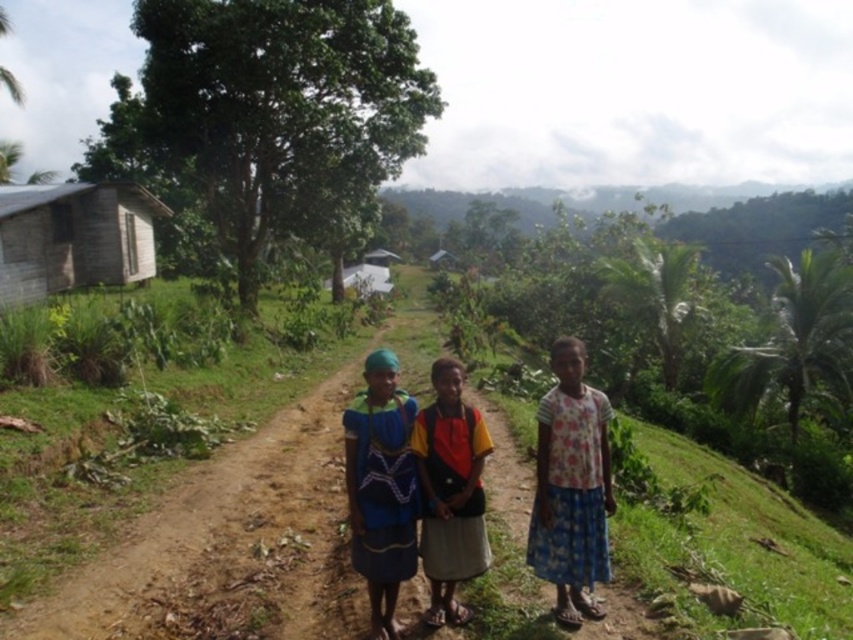
You are standing on the brown dirt path at center and want to reach the blue woven fabric dress at center. Which direction should you move to get closer to the dress?

You should move upward because the brown dirt path at center is located below the blue woven fabric dress at center, so moving upward will bring you closer to the dress.

You are standing on the dirt path and want to take a photo of both the floral fabric skirt at center and the weathered wood hut at upper left. Which object should you focus on first to ensure both are in clear view?

You should focus on the floral fabric skirt at center first because it is closer to you than the weathered wood hut at upper left, ensuring both are in focus when using depth of field.